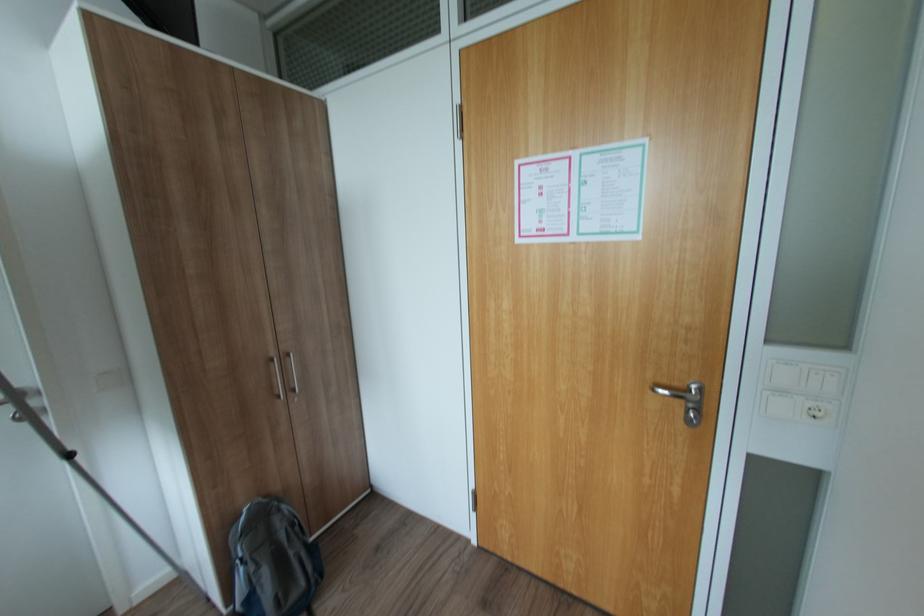
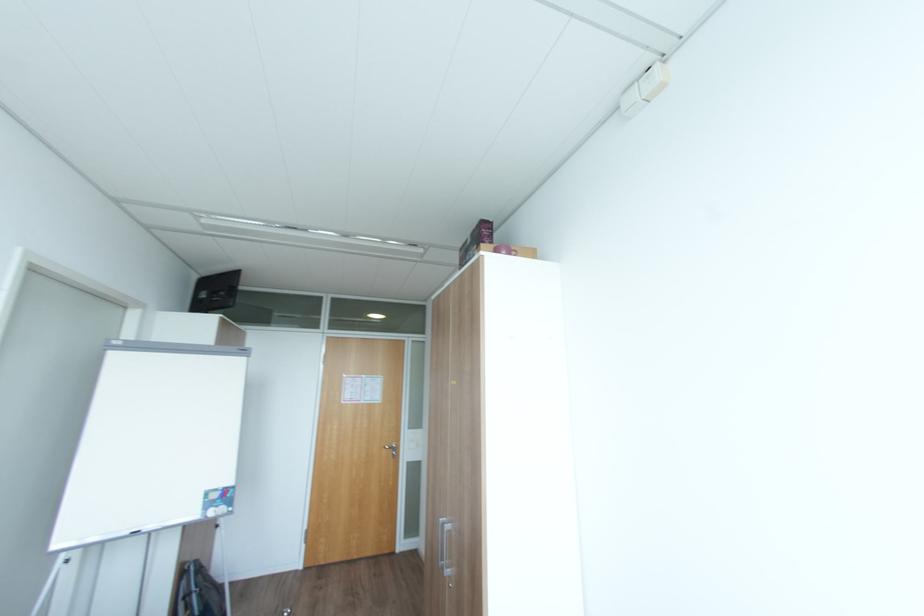
In the second image, find the point that corresponds to (x=664, y=390) in the first image.

(392, 448)